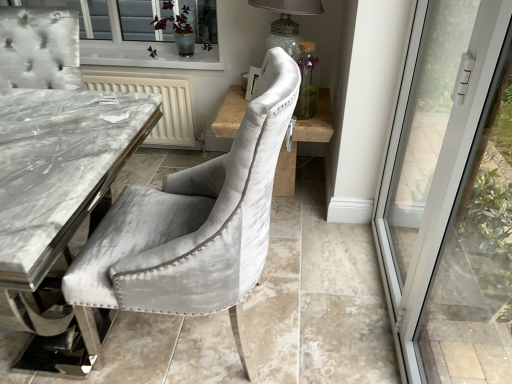
Locate an element on the screen. The image size is (512, 384). vacant space to the left of transparent glass door at right is located at coordinates (323, 325).